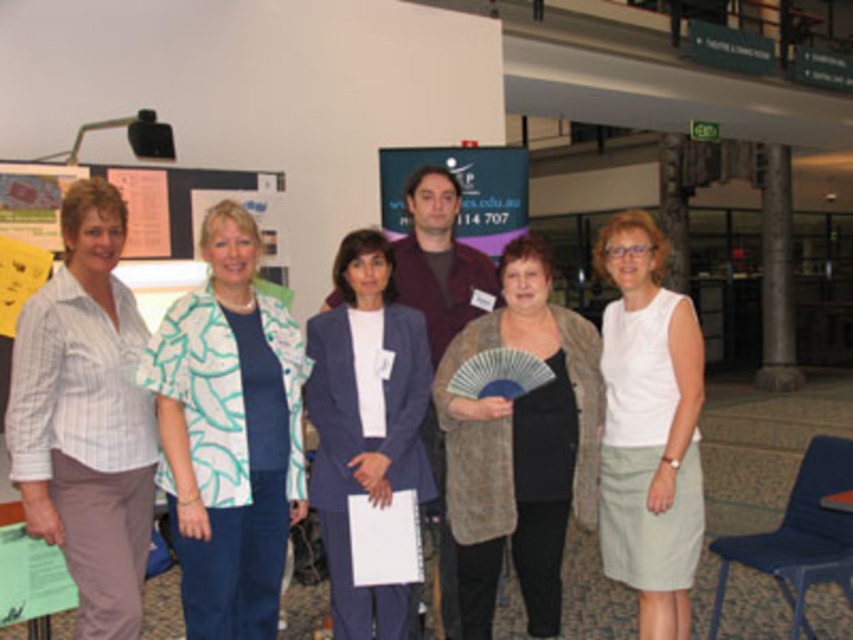
You are organizing a group photo and need to arrange the printed fabric shirt at left and the matte blue suit at center so that they are side by side. Given their widths, which one should be placed on the left to ensure proper spacing?

The printed fabric shirt at left should be placed on the left since it is wider than the matte blue suit at center, ensuring proper spacing between them.

In the scene shown: You are a photographer at the event and want to capture both the printed fabric shirt at left and the white fabric shirt at center in a single photo. Based on their positions, which shirt should you focus on first to ensure both are in frame?

The printed fabric shirt at left is located above the white fabric shirt at center, so focusing on the printed fabric shirt at left first will help ensure both are within the frame.

You are organizing a photo shoot and need to ensure that the striped cotton shirt at left and the matte blue suit at center are visible in the frame. Given their sizes, which one might require more careful positioning to avoid being overshadowed?

The striped cotton shirt at left has a smaller size compared to matte blue suit at center, so it might require more careful positioning to avoid being overshadowed by the larger matte blue suit at center.